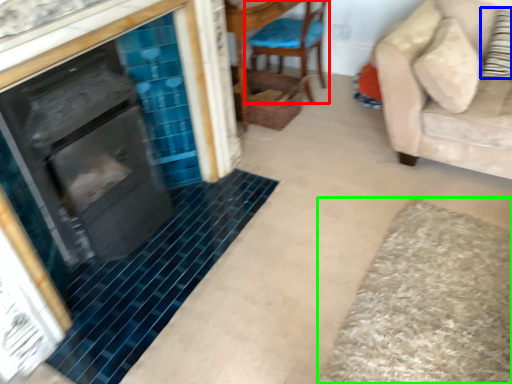
Question: Estimate the real-world distances between objects in this image. Which object is farther from chair (highlighted by a red box), pillow (highlighted by a blue box) or bath mat (highlighted by a green box)?

Choices:
 (A) pillow
 (B) bath mat

Answer: (B)